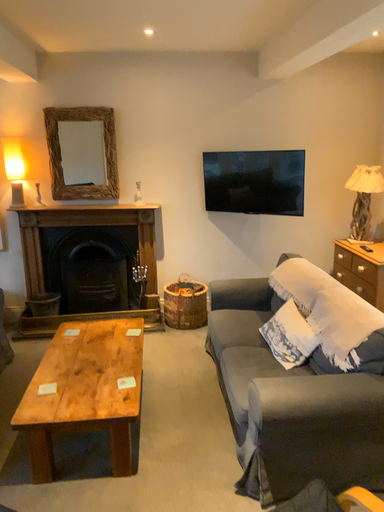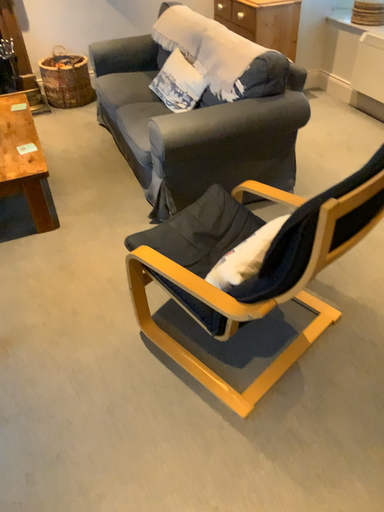
Question: How did the camera likely rotate when shooting the video?

Choices:
 (A) rotated left
 (B) rotated right

Answer: (B)